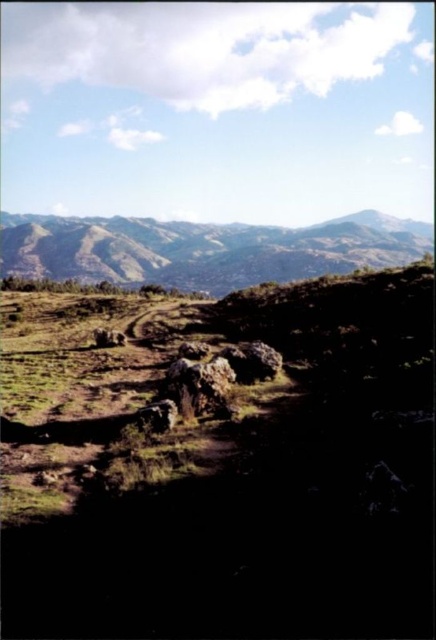
You are standing at the starting point of the dirt path in the rugged mountain landscape. You see a point marked at coordinate (x=220, y=465). What does this point indicate in the scene?

The point at coordinate (x=220, y=465) marks the green grassy hillside at lower left in the scene.

You are a hiker planning to cross the terrain shown in the image. You need to climb over the rough textured rock at center and then ascend the green grassy hillside at lower left. Which part of the climb will require more effort due to height? Please explain your reasoning based on the scene.

The green grassy hillside at lower left is taller than the rough textured rock at center. Therefore, ascending the green grassy hillside at lower left will require more effort due to its greater height compared to the rough textured rock at center.

You are standing at the point closer to the camera in the image. Which point are you at, point (170,627) or point (77,221)?

You are at point (170,627) because it is closer to the camera than point (77,221).